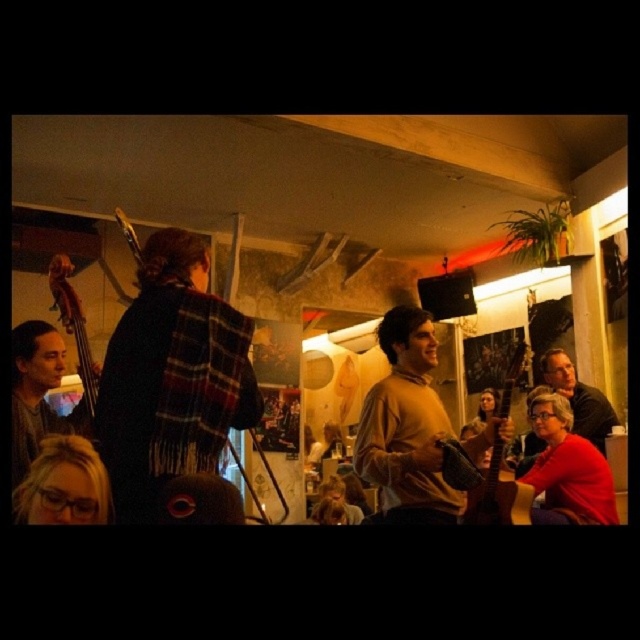
Is point (51, 412) more distant than point (596, 445)?

No, it is in front of (596, 445).

Can you confirm if matte black guitar at left is thinner than matte black guitar at right?

Correct, matte black guitar at left's width is less than matte black guitar at right's.

Does point (32, 420) come farther from viewer compared to point (588, 401)?

No, (32, 420) is in front of (588, 401).

Identify the location of matte black guitar at left. (35, 392).

Can you confirm if matte black guitar at left is thinner than wooden acoustic guitar at right?

Yes.

Can you confirm if matte black guitar at left is positioned to the right of wooden acoustic guitar at right?

In fact, matte black guitar at left is to the left of wooden acoustic guitar at right.

In order to click on matte black guitar at left in this screenshot , I will do `click(35, 392)`.

Find the location of a particular element. matte black guitar at left is located at coordinates (35, 392).

Which of these two, red matte shirt at lower right or wooden acoustic guitar at right, stands shorter?

With less height is red matte shirt at lower right.

Does red matte shirt at lower right appear on the right side of wooden acoustic guitar at right?

Correct, you'll find red matte shirt at lower right to the right of wooden acoustic guitar at right.

Is point (577, 516) positioned in front of point (481, 483)?

No, (577, 516) is behind (481, 483).

The width and height of the screenshot is (640, 640). What are the coordinates of `red matte shirt at lower right` in the screenshot? It's located at (566, 468).